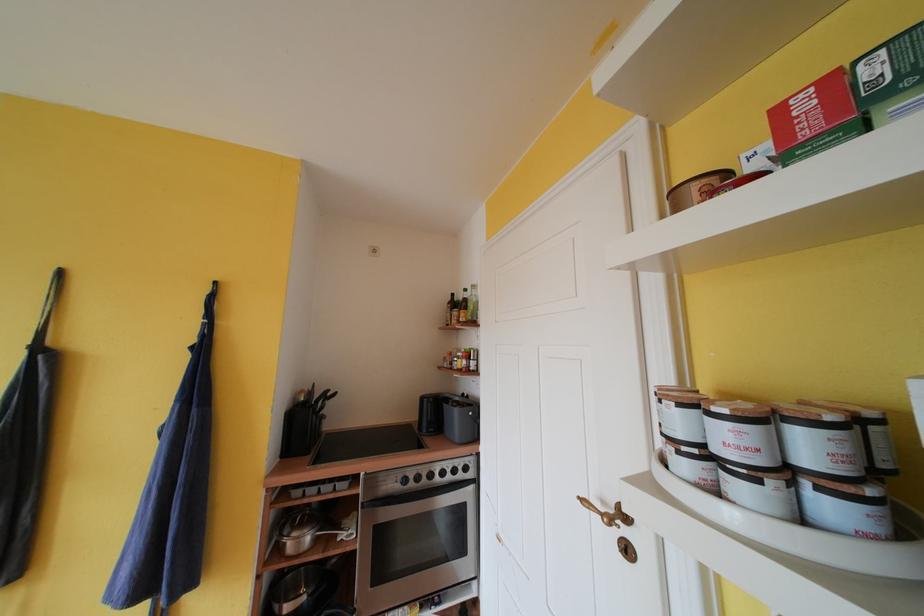
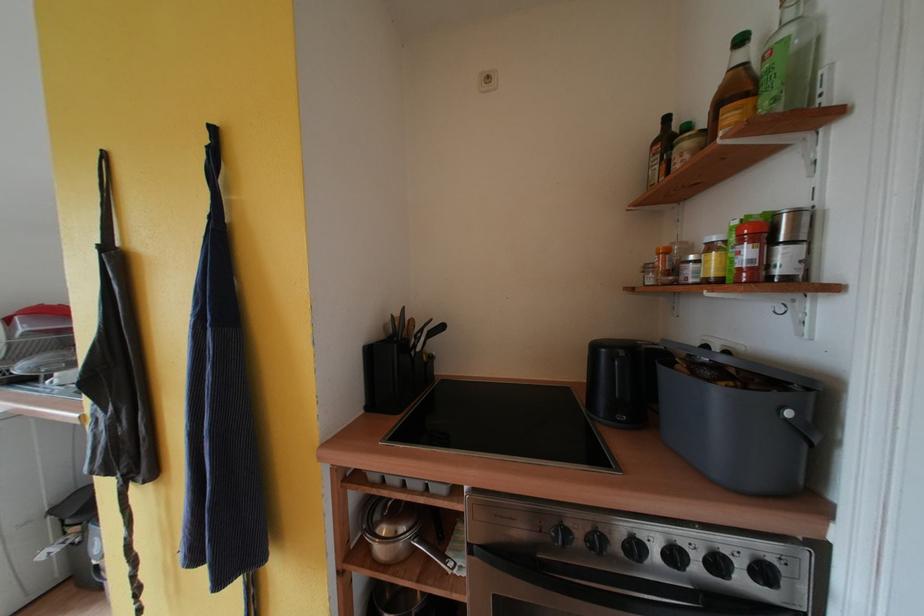
Locate, in the second image, the point that corresponds to point (463, 414) in the first image.

(723, 397)